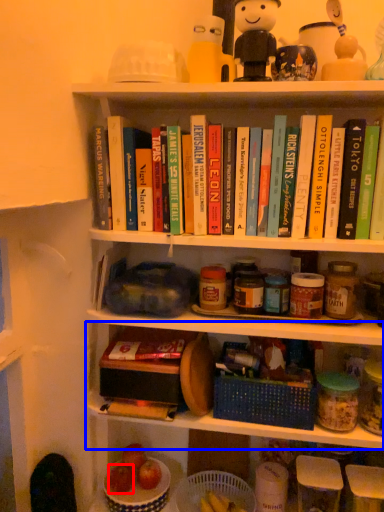
Question: Which object appears closest to the camera in this image, apple (highlighted by a red box) or shelf (highlighted by a blue box)?

Choices:
 (A) apple
 (B) shelf

Answer: (B)